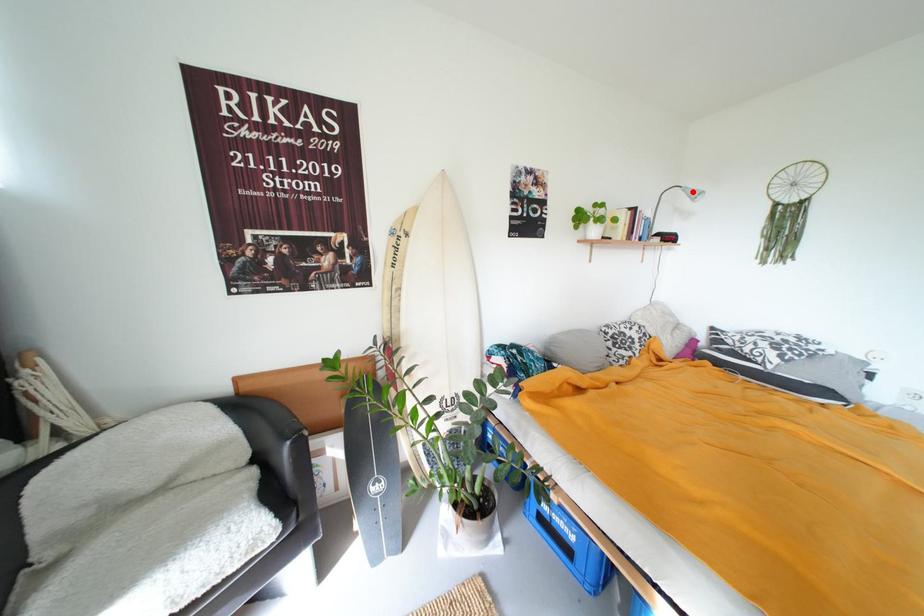
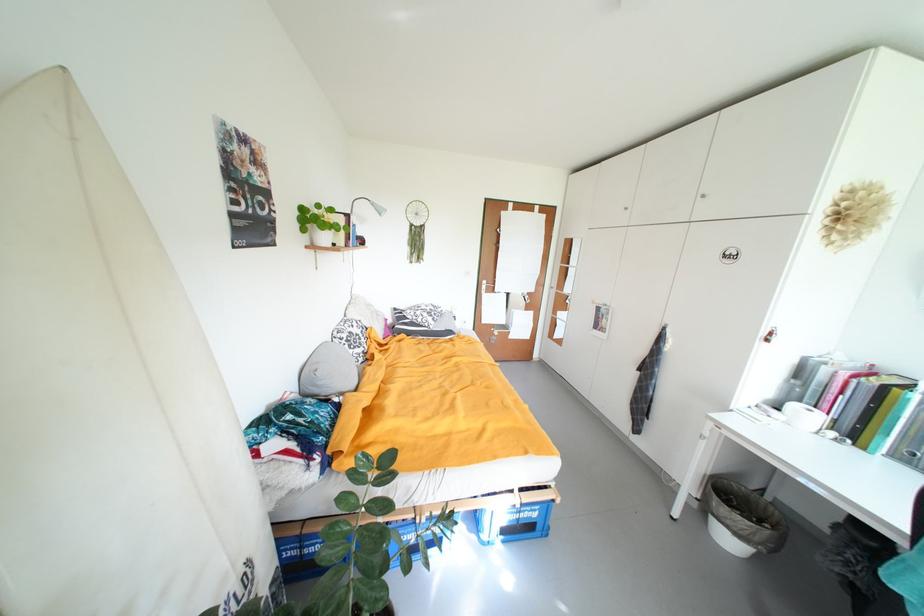
Locate, in the second image, the point that corresponds to the highlighted location in the first image.

(381, 206)